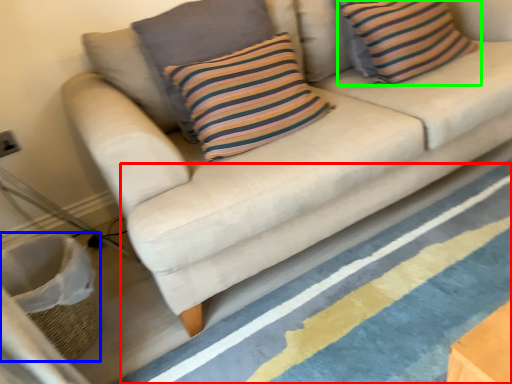
Question: Considering the real-world distances, which object is farthest from stripe (highlighted by a red box)? basket (highlighted by a blue box) or pillow (highlighted by a green box)?

Choices:
 (A) basket
 (B) pillow

Answer: (B)